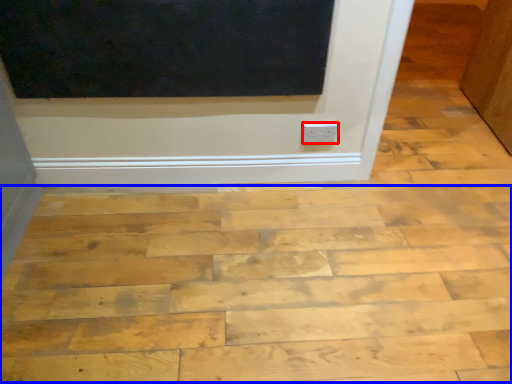
Question: Which of the following is the farthest to the observer, electric outlet (highlighted by a red box) or plywood (highlighted by a blue box)?

Choices:
 (A) electric outlet
 (B) plywood

Answer: (A)